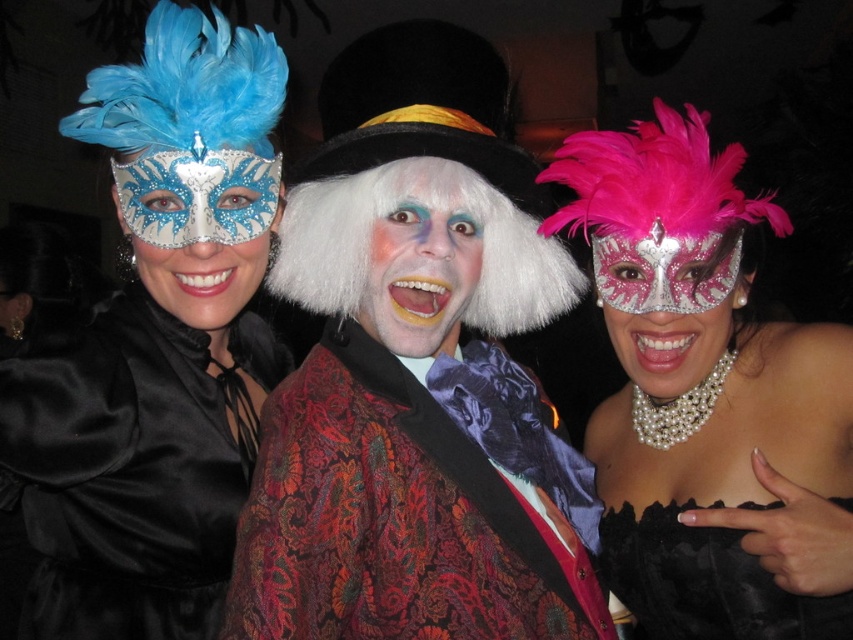
Question: Observing the image, what is the correct spatial positioning of satin mask at left in reference to white matte wig at center?

Choices:
 (A) above
 (B) below

Answer: (B)

Question: Which object appears closest to the camera in this image?

Choices:
 (A) pink glittery mask at center
 (B) white matte wig at center

Answer: (B)

Question: Which object is farther from the camera taking this photo?

Choices:
 (A) pearl necklace at center
 (B) matte silver mask at center
 (C) satin mask at left

Answer: (B)

Question: Is satin mask at left closer to the viewer compared to pink glittery mask at center?

Choices:
 (A) no
 (B) yes

Answer: (B)

Question: Does shiny velvet coat at center appear under black lace corset at center?

Choices:
 (A) no
 (B) yes

Answer: (A)

Question: Which object is farther from the camera taking this photo?

Choices:
 (A) white matte wig at center
 (B) pink glittery mask at center
 (C) black lace corset at center

Answer: (B)